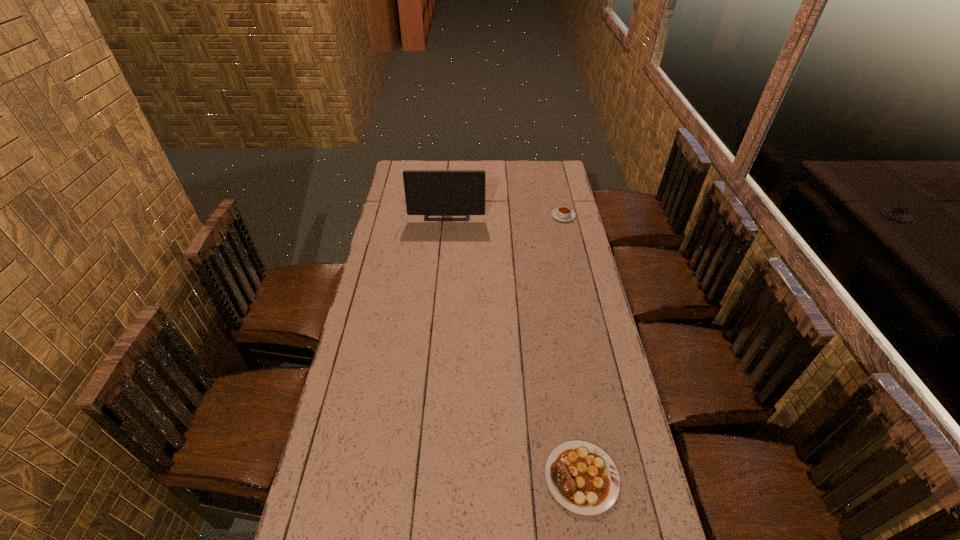
The width and height of the screenshot is (960, 540). I want to click on free space between the pudding and the computer monitor, so click(505, 214).

I want to click on free space between the steak and the computer monitor, so click(515, 346).

I want to click on free point between the leftmost object and the steak, so click(515, 346).

This screenshot has height=540, width=960. I want to click on free space between the tallest object and the steak, so click(x=515, y=346).

Identify the location of object that ranks as the second closest to the steak. The width and height of the screenshot is (960, 540). (427, 192).

Identify which object is located as the second nearest to the tallest object. Please provide its 2D coordinates. Your answer should be formatted as a tuple, i.e. [(x, y)], where the tuple contains the x and y coordinates of a point satisfying the conditions above.

[(582, 477)]

Locate an element on the screen. This screenshot has width=960, height=540. free space that satisfies the following two spatial constraints: 1. on the screen side of the leftmost object; 2. on the left side of the nearest object is located at coordinates (423, 477).

Locate an element on the screen. The height and width of the screenshot is (540, 960). vacant region that satisfies the following two spatial constraints: 1. on the screen side of the leftmost object; 2. on the left side of the nearest object is located at coordinates (423, 477).

I want to click on vacant region that satisfies the following two spatial constraints: 1. on the screen side of the steak; 2. on the left side of the computer monitor, so click(423, 477).

In order to click on free spot that satisfies the following two spatial constraints: 1. on the screen side of the tallest object; 2. on the right side of the steak in this screenshot , I will do `click(423, 477)`.